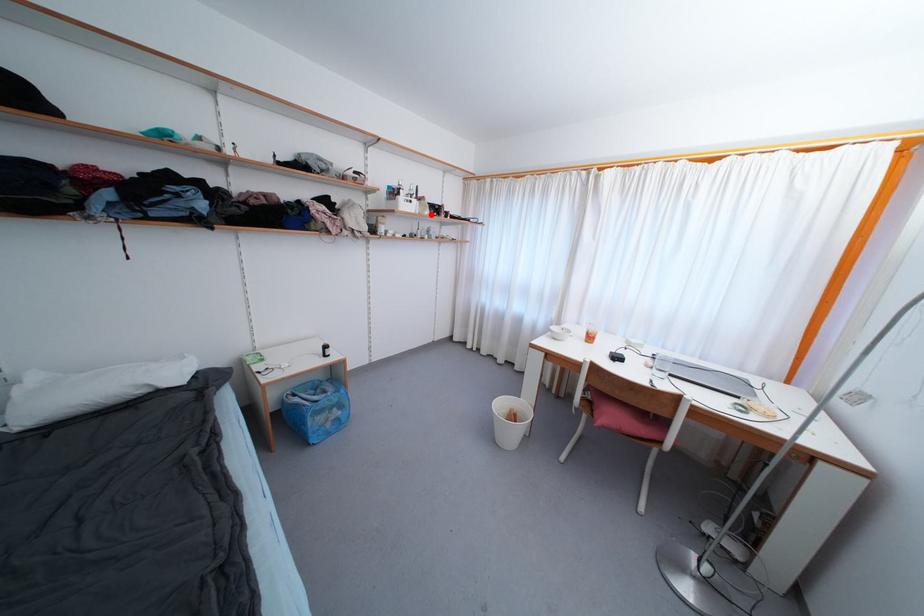
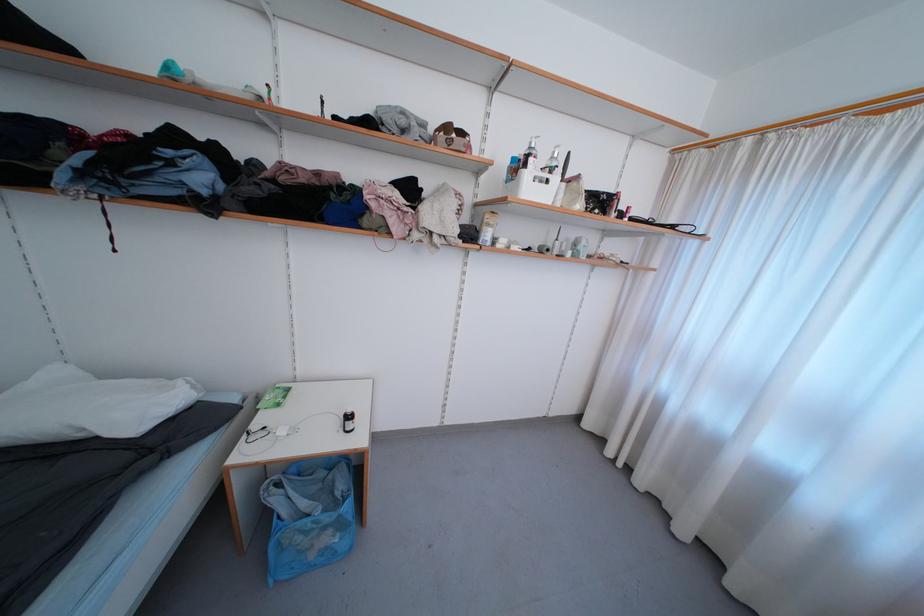
Find the pixel in the second image that matches the highlighted location in the first image.

(584, 208)